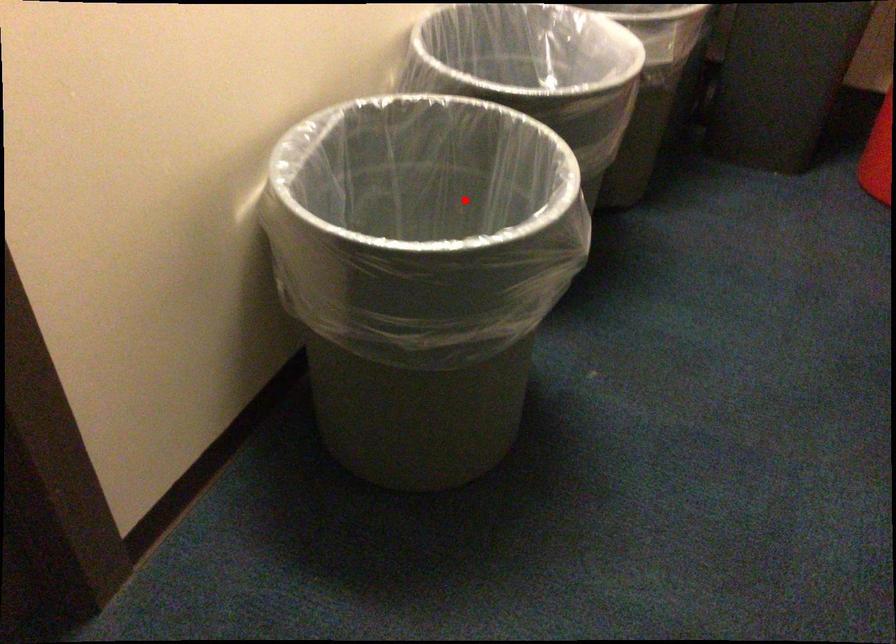
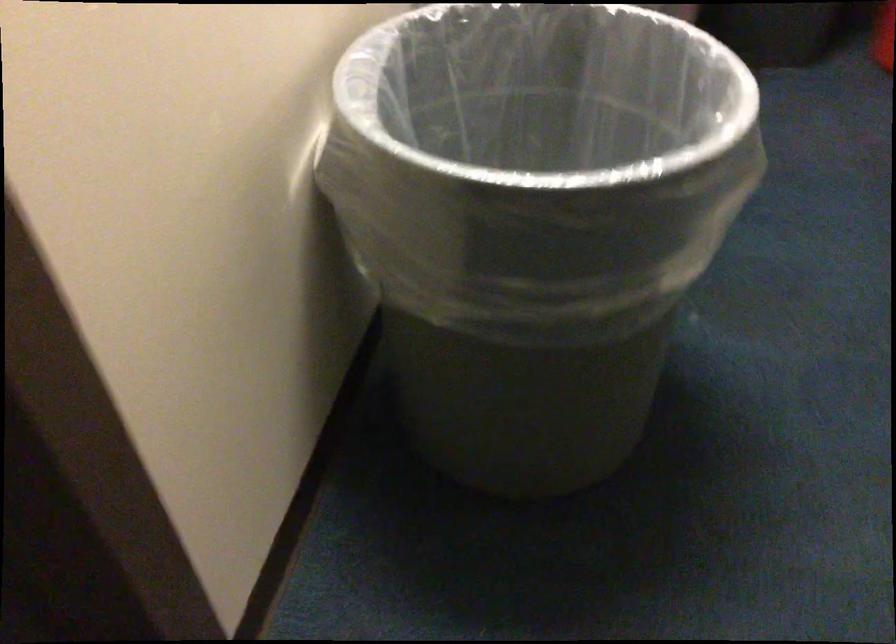
Question: I am providing you with two images of the same scene from different viewpoints. A red point is shown in image1. For the corresponding object point in image2, is it positioned nearer or farther from the camera?

Choices:
 (A) Nearer
 (B) Farther

Answer: (A)